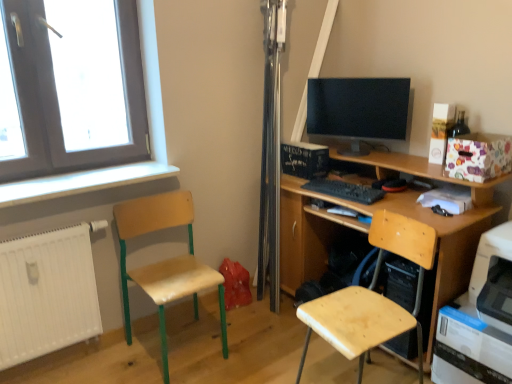
Identify the location of empty space that is ontop of white painted wood at left. (70, 177).